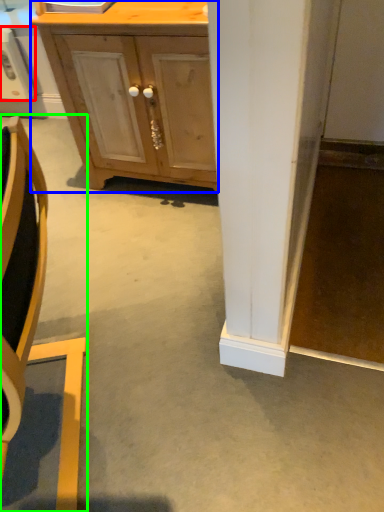
Question: Based on their relative distances, which object is nearer to appliance (highlighted by a red box)? Choose from cabinetry (highlighted by a blue box) and chair (highlighted by a green box).

Choices:
 (A) cabinetry
 (B) chair

Answer: (A)